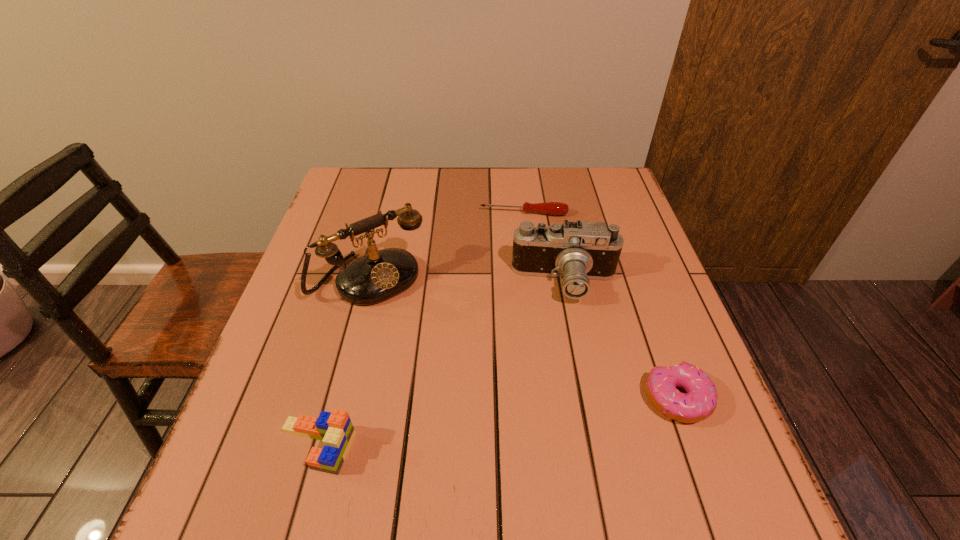
The width and height of the screenshot is (960, 540). I want to click on blank area located on the dial of the tallest object, so click(499, 426).

Locate an element on the screen. vacant space positioned at the tip of the screwdriver is located at coordinates (520, 238).

At what (x,y) coordinates should I click in order to perform the action: click on free spot located 0.360m at the tip of the screwdriver. Please return your answer as a coordinate pair (x, y). This screenshot has height=540, width=960. Looking at the image, I should click on (518, 313).

Image resolution: width=960 pixels, height=540 pixels. What are the coordinates of `vacant region located 0.160m at the tip of the screwdriver` in the screenshot? It's located at (519, 255).

The width and height of the screenshot is (960, 540). Find the location of `vacant space situated at the lens of the fourth shortest object`. vacant space situated at the lens of the fourth shortest object is located at coordinates (552, 341).

Where is `free space located at the lens of the fourth shortest object`? Image resolution: width=960 pixels, height=540 pixels. free space located at the lens of the fourth shortest object is located at coordinates (549, 360).

Where is `vacant space situated at the lens of the fourth shortest object`? The width and height of the screenshot is (960, 540). vacant space situated at the lens of the fourth shortest object is located at coordinates pos(539,431).

I want to click on object that is at the far edge, so click(x=550, y=208).

At what (x,y) coordinates should I click in order to perform the action: click on Lego at the near edge. Please return your answer as a coordinate pair (x, y). Image resolution: width=960 pixels, height=540 pixels. Looking at the image, I should click on (335, 430).

What are the coordinates of `doughnut at the near edge` in the screenshot? It's located at (699, 402).